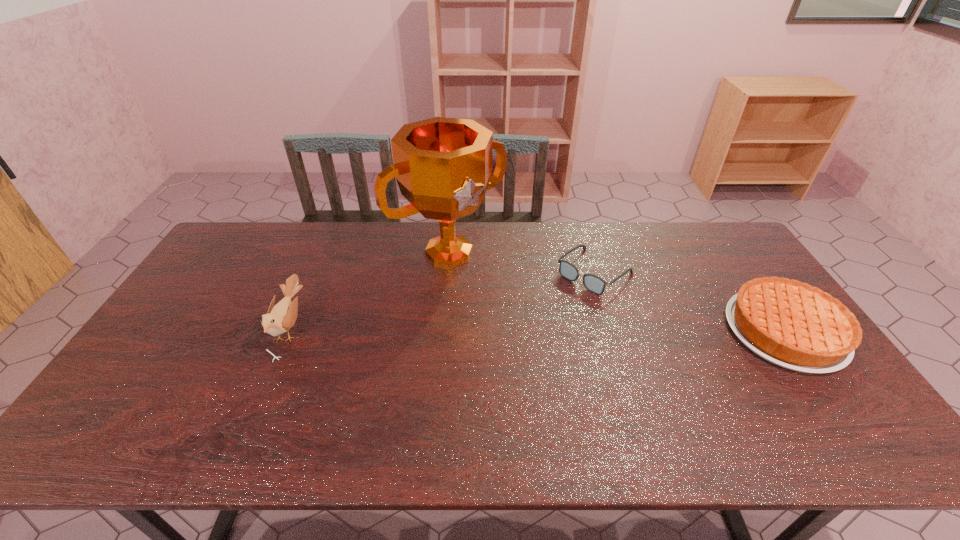
Where is `free space located on the back of the pie`? This screenshot has width=960, height=540. free space located on the back of the pie is located at coordinates (745, 274).

Find the location of a particular element. The height and width of the screenshot is (540, 960). vacant region located on the face of the shortest object is located at coordinates (558, 305).

Find the location of a particular element. Image resolution: width=960 pixels, height=540 pixels. blank space located 0.120m on the face of the shortest object is located at coordinates (550, 312).

What are the coordinates of `free spot located 0.380m on the face of the shortest object` in the screenshot? It's located at (492, 363).

Where is `free location located on the side of the third object from right to left with the star emblem`? This screenshot has height=540, width=960. free location located on the side of the third object from right to left with the star emblem is located at coordinates (544, 338).

In order to click on free space located on the side of the third object from right to left with the star emblem in this screenshot , I will do `click(501, 295)`.

You are a GUI agent. You are given a task and a screenshot of the screen. Output one action in this format:
    pyautogui.click(x=<x>, y=<y>)
    Task: Click on the free spot located on the side of the third object from right to left with the star emblem
    
    Given the screenshot: What is the action you would take?
    pyautogui.click(x=556, y=349)

Locate an element on the screen. spectacles located at the far edge is located at coordinates (593, 283).

In order to click on award that is at the far edge in this screenshot , I will do `click(443, 166)`.

Find the location of a particular element. object at the right edge is located at coordinates (794, 325).